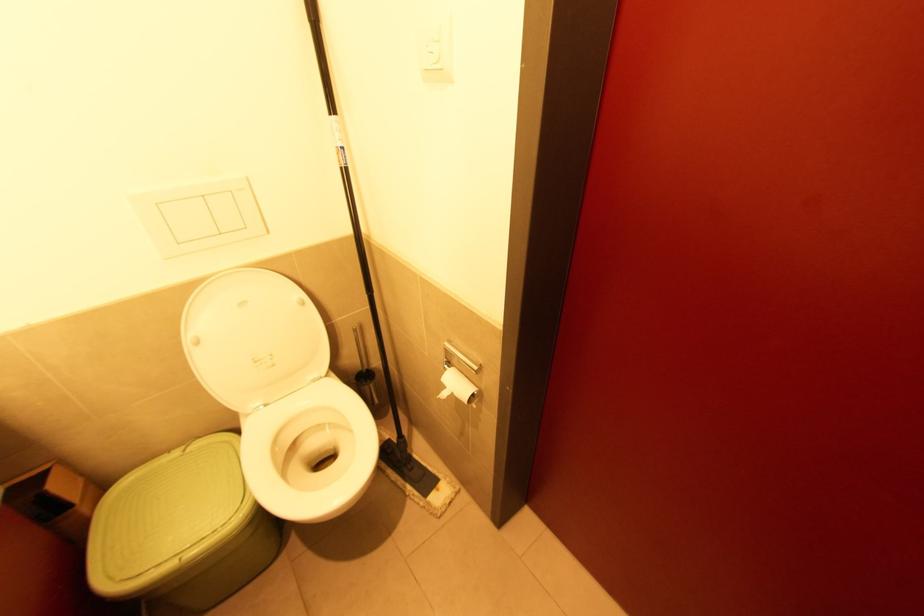
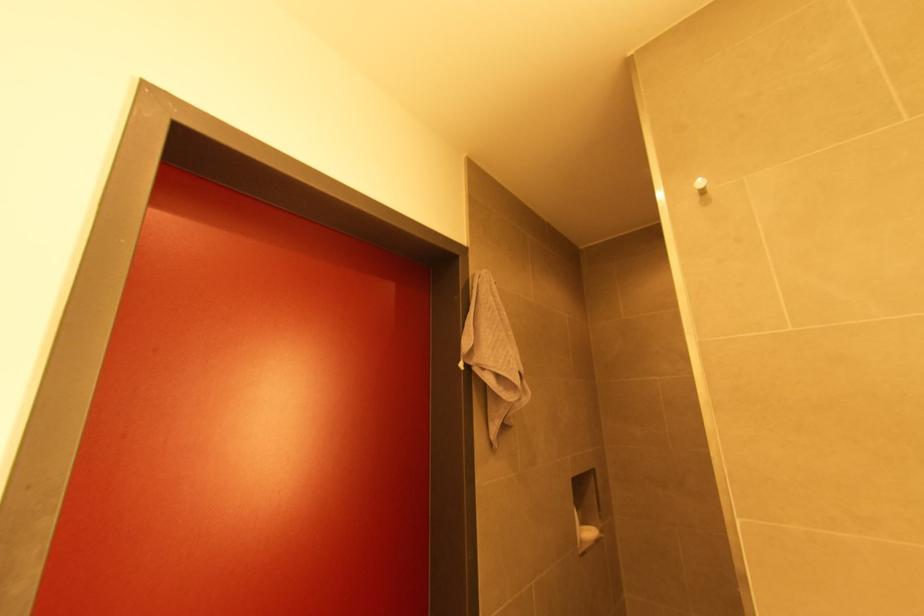
Question: The first image is from the beginning of the video and the second image is from the end. How did the camera likely rotate when shooting the video?

Choices:
 (A) Left
 (B) Right
 (C) Up
 (D) Down

Answer: (B)